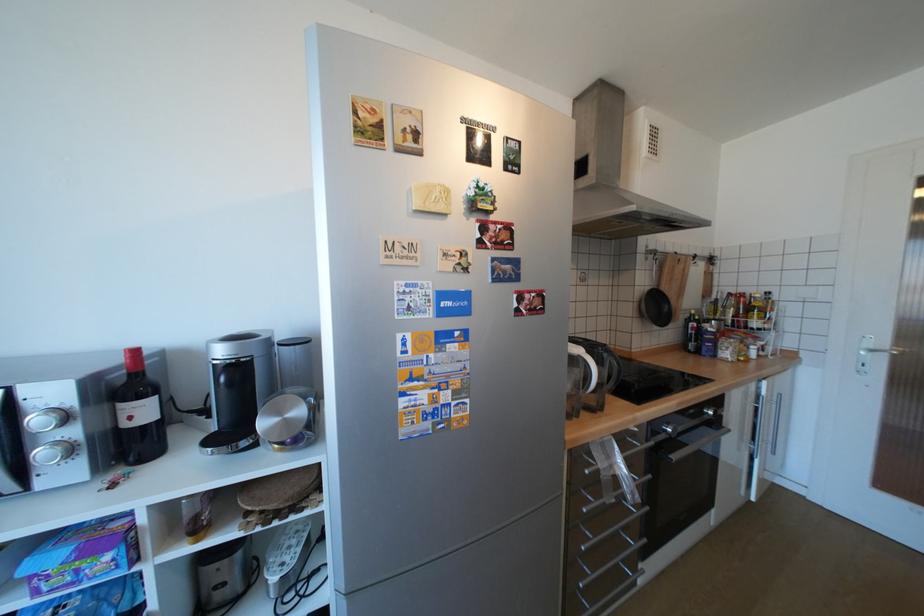
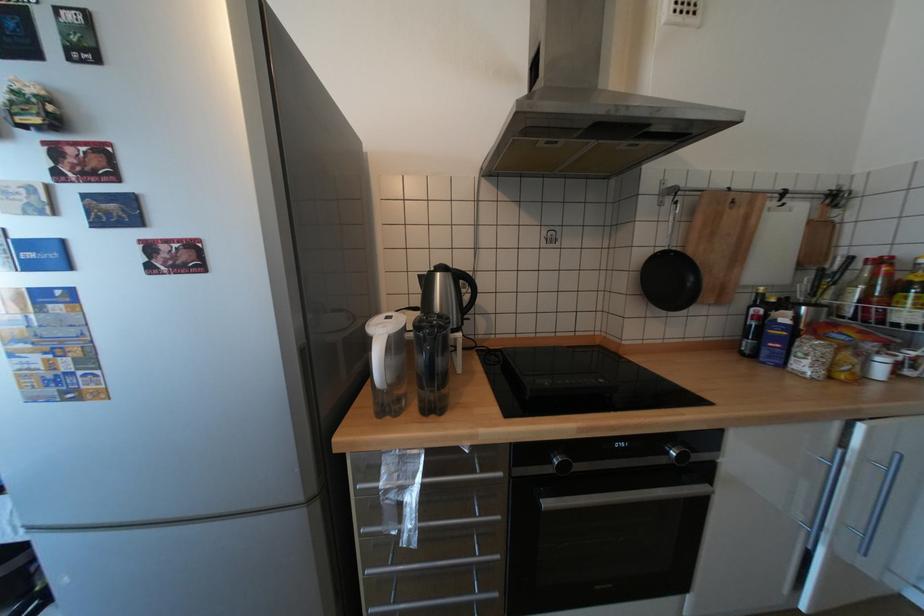
Question: The first image is from the beginning of the video and the second image is from the end. How did the camera likely rotate when shooting the video?

Choices:
 (A) Left
 (B) Right
 (C) Up
 (D) Down

Answer: (A)